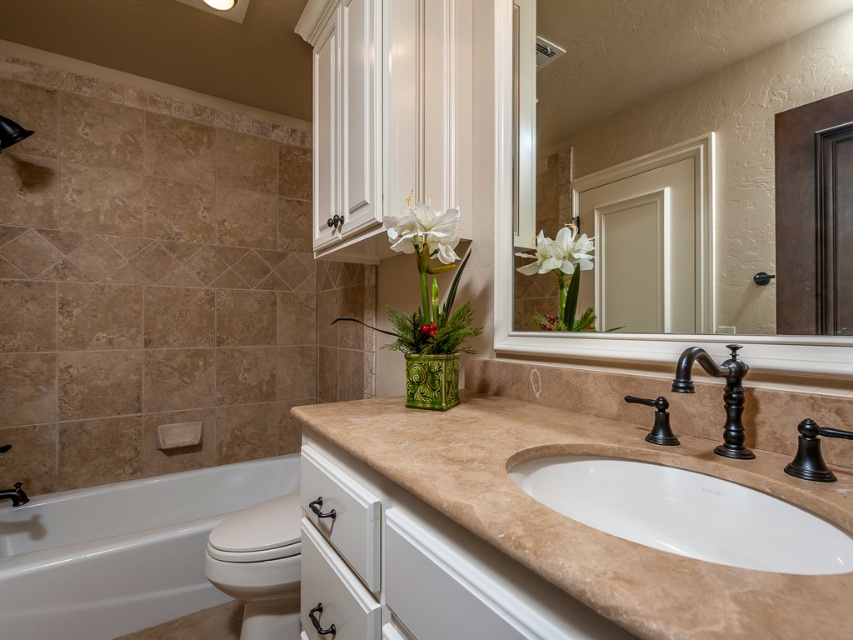
You are standing in the bathroom and want to reach both the point at coordinates (735, 451) and the point at coordinates (427, 364). Which point will you reach first?

You will reach the point at coordinates (735, 451) first because it is closer to you than the point at coordinates (427, 364).